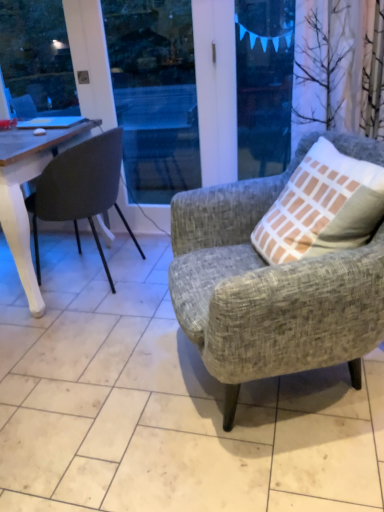
Measure the distance between point [63,156] and camera.

The depth of point [63,156] is 6.41 feet.

This screenshot has height=512, width=384. What do you see at coordinates (264, 85) in the screenshot?
I see `transparent plastic window screen at upper center` at bounding box center [264, 85].

The width and height of the screenshot is (384, 512). Describe the element at coordinates (268, 290) in the screenshot. I see `textured gray armchair at right, acting as the 1th chair starting from the right` at that location.

The width and height of the screenshot is (384, 512). I want to click on matte black chair at left, the 1th chair when ordered from back to front, so click(80, 189).

Which chair is the 1st one when counting from the front of the transparent plastic window screen at upper center? Please provide its 2D coordinates.

[(80, 189)]

From a real-world perspective, is transparent plastic window screen at upper center located higher than matte black chair at left, the 1th chair when ordered from back to front?

Yes, from a real-world perspective, transparent plastic window screen at upper center is over matte black chair at left, the 1th chair when ordered from back to front

Can you confirm if transparent plastic window screen at upper center is smaller than matte black chair at left, the 1th chair when ordered from back to front?

Correct, transparent plastic window screen at upper center occupies less space than matte black chair at left, the 1th chair when ordered from back to front.

From the picture: Considering the positions of objects transparent plastic window screen at upper center and matte black chair at left, the 1th chair when ordered from back to front, in the image provided, who is in front, transparent plastic window screen at upper center or matte black chair at left, the 1th chair when ordered from back to front,?

matte black chair at left, the 1th chair when ordered from back to front, is in front.

Which object is closer to the camera, matte black chair at left, the 1th chair when ordered from back to front, or transparent plastic window screen at upper center?

matte black chair at left, the 1th chair when ordered from back to front, is more forward.

Between point (92, 145) and point (247, 138), which one is positioned in front?

Point (92, 145)

Considering the relative sizes of textured gray armchair at right, the second chair viewed from the left, and matte black chair at left, the 1th chair when ordered from back to front, in the image provided, is textured gray armchair at right, the second chair viewed from the left, shorter than matte black chair at left, the 1th chair when ordered from back to front,?

No.

Looking at this image, which object is closer to the camera, textured gray armchair at right, which appears as the first chair when viewed from the front, or matte black chair at left, arranged as the second chair when viewed from the front?

textured gray armchair at right, which appears as the first chair when viewed from the front.

From the image's perspective, is textured gray armchair at right, marked as the 2th chair in a back-to-front arrangement, positioned above or below matte black chair at left, the 1th chair when ordered from back to front?

textured gray armchair at right, marked as the 2th chair in a back-to-front arrangement, is below matte black chair at left, the 1th chair when ordered from back to front.

Is textured gray armchair at right, marked as the 2th chair in a back-to-front arrangement, smaller than matte black chair at left, which ranks as the 1th chair in left-to-right order?

No, textured gray armchair at right, marked as the 2th chair in a back-to-front arrangement, is not smaller than matte black chair at left, which ranks as the 1th chair in left-to-right order.

From the image's perspective, is matte black chair at left, positioned as the 2th chair in right-to-left order, over textured gray armchair at right, acting as the 1th chair starting from the right?

Yes, from the image's perspective, matte black chair at left, positioned as the 2th chair in right-to-left order, is above textured gray armchair at right, acting as the 1th chair starting from the right.

Considering the positions of points (25, 202) and (350, 334), is point (25, 202) farther from camera compared to point (350, 334)?

Yes.

Which of these two, matte black chair at left, arranged as the second chair when viewed from the front, or textured gray armchair at right, marked as the 2th chair in a back-to-front arrangement, stands shorter?

matte black chair at left, arranged as the second chair when viewed from the front.

Is the position of matte black chair at left, arranged as the second chair when viewed from the front, less distant than that of textured gray armchair at right, marked as the 2th chair in a back-to-front arrangement?

No, it is behind textured gray armchair at right, marked as the 2th chair in a back-to-front arrangement.

From the image's perspective, does transparent plastic window screen at upper center appear lower than textured gray armchair at right, which appears as the first chair when viewed from the front?

No, from the image's perspective, transparent plastic window screen at upper center is not below textured gray armchair at right, which appears as the first chair when viewed from the front.

Who is bigger, transparent plastic window screen at upper center or textured gray armchair at right, the second chair viewed from the left?

With larger size is textured gray armchair at right, the second chair viewed from the left.

Could you measure the distance between transparent plastic window screen at upper center and textured gray armchair at right, acting as the 1th chair starting from the right?

A distance of 1.16 meters exists between transparent plastic window screen at upper center and textured gray armchair at right, acting as the 1th chair starting from the right.

Is point (286, 90) positioned in front of point (272, 200)?

That is False.

Could you tell me if textured gray armchair at right, acting as the 1th chair starting from the right, is facing transparent plastic window screen at upper center?

No, textured gray armchair at right, acting as the 1th chair starting from the right, does not turn towards transparent plastic window screen at upper center.

Looking at the image, does textured gray armchair at right, the second chair viewed from the left, seem bigger or smaller compared to transparent plastic window screen at upper center?

Clearly, textured gray armchair at right, the second chair viewed from the left, is larger in size than transparent plastic window screen at upper center.

Can you tell me how much textured gray armchair at right, which appears as the first chair when viewed from the front, and transparent plastic window screen at upper center differ in facing direction?

They differ by 67.6 degrees in their facing directions.

Is transparent plastic window screen at upper center surrounded by textured gray armchair at right, acting as the 1th chair starting from the right?

No, transparent plastic window screen at upper center is not a part of textured gray armchair at right, acting as the 1th chair starting from the right.

At what (x,y) coordinates should I click in order to perform the action: click on chair that is the 1st object located below the transparent plastic window screen at upper center (from the image's perspective). Please return your answer as a coordinate pair (x, y). This screenshot has height=512, width=384. Looking at the image, I should click on (80, 189).

Identify the location of window screen located behind the matte black chair at left, the 1th chair when ordered from back to front. (264, 85).

From the image, which object appears to be farther from transparent plastic window screen at upper center, textured gray armchair at right, acting as the 1th chair starting from the right, or matte black chair at left, arranged as the second chair when viewed from the front?

The object further to transparent plastic window screen at upper center is textured gray armchair at right, acting as the 1th chair starting from the right.

Looking at the image, which one is located further to matte black chair at left, which ranks as the 1th chair in left-to-right order, transparent plastic window screen at upper center or textured gray armchair at right, which appears as the first chair when viewed from the front?

transparent plastic window screen at upper center.

Which object lies nearer to the anchor point textured gray armchair at right, the second chair viewed from the left, matte black chair at left, arranged as the second chair when viewed from the front, or transparent plastic window screen at upper center?

The object closer to textured gray armchair at right, the second chair viewed from the left, is matte black chair at left, arranged as the second chair when viewed from the front.

Looking at the image, which one is located closer to transparent plastic window screen at upper center, matte black chair at left, the 1th chair when ordered from back to front, or textured gray armchair at right, which appears as the first chair when viewed from the front?

matte black chair at left, the 1th chair when ordered from back to front.

Considering their positions, is transparent plastic window screen at upper center positioned closer to textured gray armchair at right, the second chair viewed from the left, than matte black chair at left, positioned as the 2th chair in right-to-left order?

matte black chair at left, positioned as the 2th chair in right-to-left order, is closer to textured gray armchair at right, the second chair viewed from the left.

Considering their positions, is textured gray armchair at right, the second chair viewed from the left, positioned further to matte black chair at left, arranged as the second chair when viewed from the front, than transparent plastic window screen at upper center?

transparent plastic window screen at upper center lies further to matte black chair at left, arranged as the second chair when viewed from the front, than the other object.

The image size is (384, 512). In order to click on chair located between textured gray armchair at right, acting as the 1th chair starting from the right, and transparent plastic window screen at upper center in the depth direction in this screenshot , I will do [80, 189].